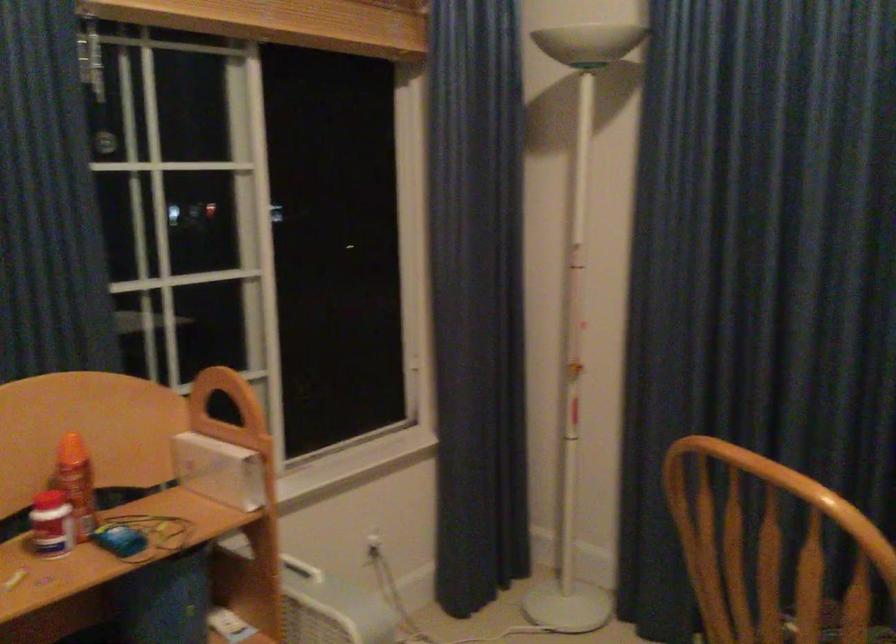
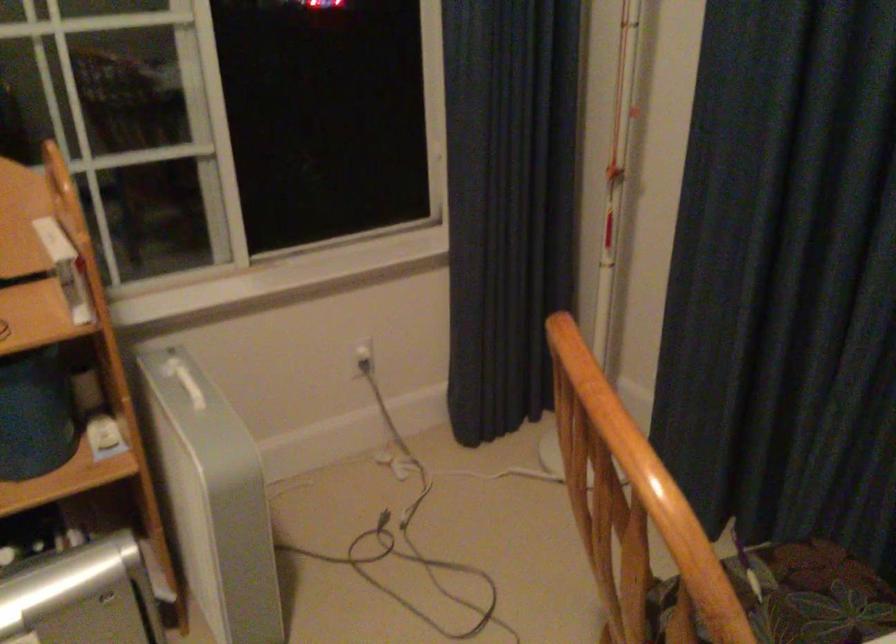
Where in the second image is the point corresponding to point (374, 541) from the first image?

(363, 355)